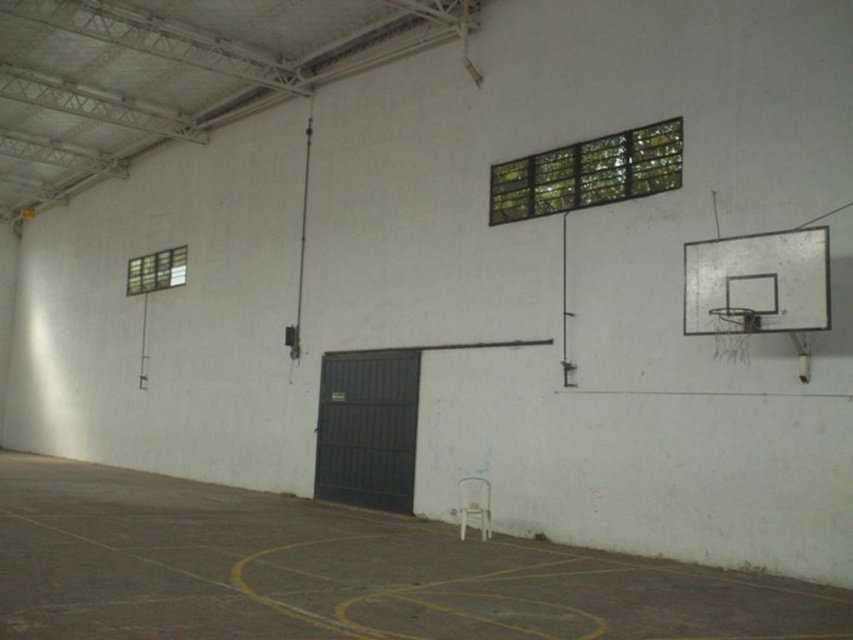
You are standing in the middle of the basketball court and want to move towards the two points marked in the image. Which point, point (x=187, y=614) or point (x=747, y=324), will you reach first?

You will reach point (x=187, y=614) first because it is closer to you than point (x=747, y=324).

You are a basketball player who just finished a game and needs to sit down. You see a white plastic chair at center and a metallic silver basketball hoop at right. Which object is taller and thus might be more suitable for sitting?

The white plastic chair at center is taller than the metallic silver basketball hoop at right, so it is more suitable for sitting.